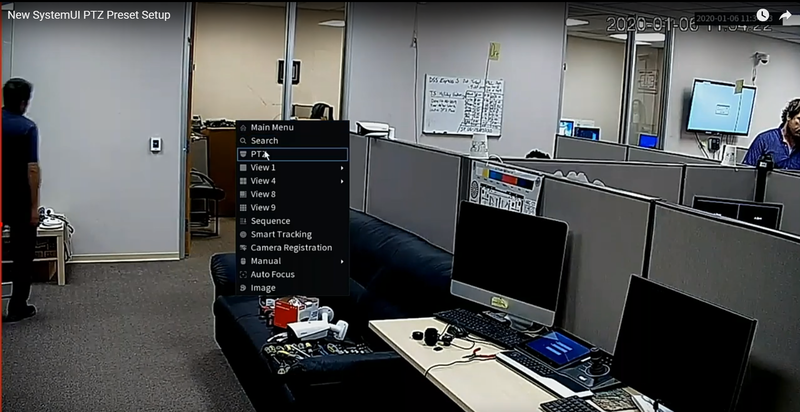
The width and height of the screenshot is (800, 412). I want to click on key board, so click(561, 411), click(461, 313).